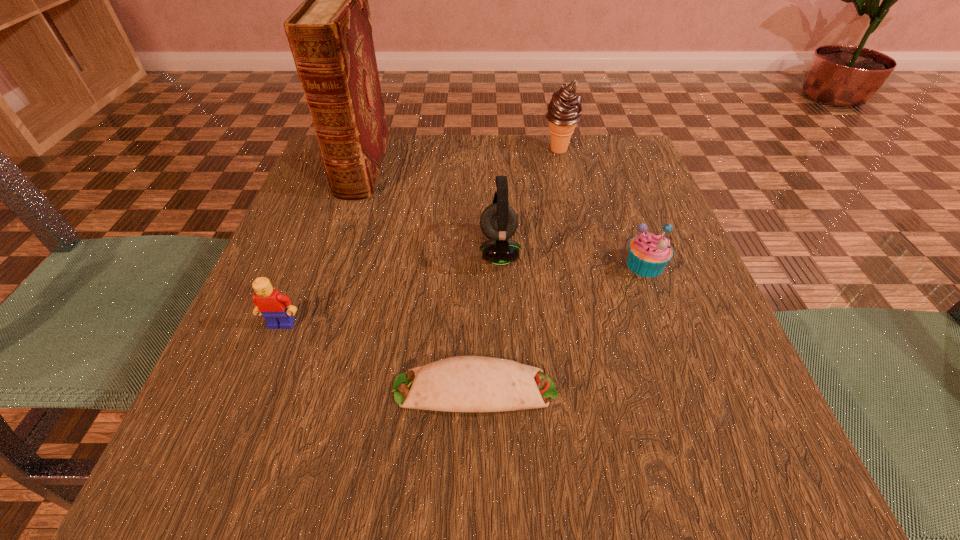
The height and width of the screenshot is (540, 960). In order to click on Lego present at the left edge in this screenshot , I will do `click(271, 304)`.

Where is `icecream that is at the right edge`? icecream that is at the right edge is located at coordinates (564, 110).

Where is `muffin at the right edge`? muffin at the right edge is located at coordinates (649, 253).

Where is `object that is at the far left corner`? object that is at the far left corner is located at coordinates (330, 33).

You are a GUI agent. You are given a task and a screenshot of the screen. Output one action in this format:
    pyautogui.click(x=<x>, y=<y>)
    Task: Click on the object that is at the far right corner
    
    Given the screenshot: What is the action you would take?
    pyautogui.click(x=564, y=110)

Image resolution: width=960 pixels, height=540 pixels. What are the coordinates of `vacant space at the far edge of the desktop` in the screenshot? It's located at (402, 141).

You are a GUI agent. You are given a task and a screenshot of the screen. Output one action in this format:
    pyautogui.click(x=<x>, y=<y>)
    Task: Click on the free space at the near edge
    The image size is (960, 540).
    Given the screenshot: What is the action you would take?
    pyautogui.click(x=614, y=451)

Identify the location of vacant space at the left edge of the desktop. (347, 235).

Identify the location of free space at the right edge of the desktop. This screenshot has height=540, width=960. point(609,264).

In the image, there is a desktop. What are the coordinates of `free space at the far left corner` in the screenshot? It's located at (314, 187).